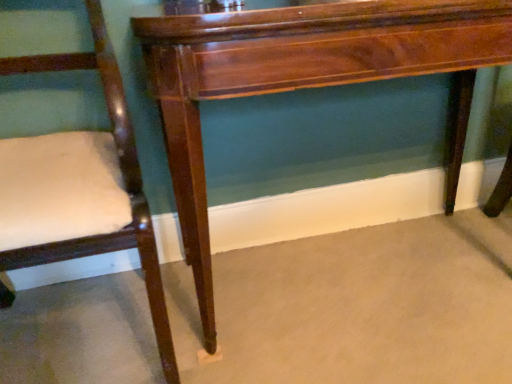
Where is `free point below mahogany wood table at center (from a real-world perspective)`? This screenshot has height=384, width=512. free point below mahogany wood table at center (from a real-world perspective) is located at coordinates (333, 274).